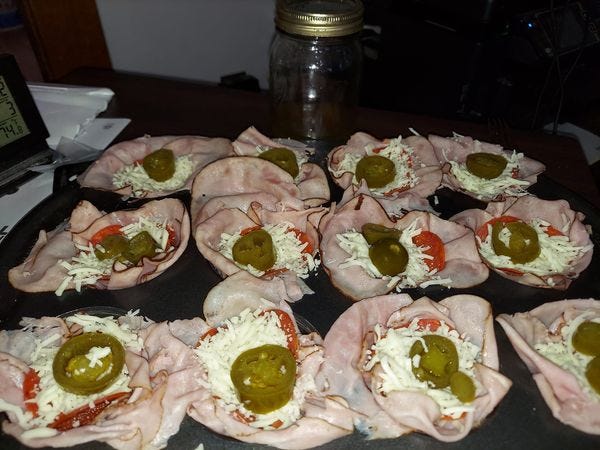
The width and height of the screenshot is (600, 450). Identify the location of golden mason jar lid. (318, 20).